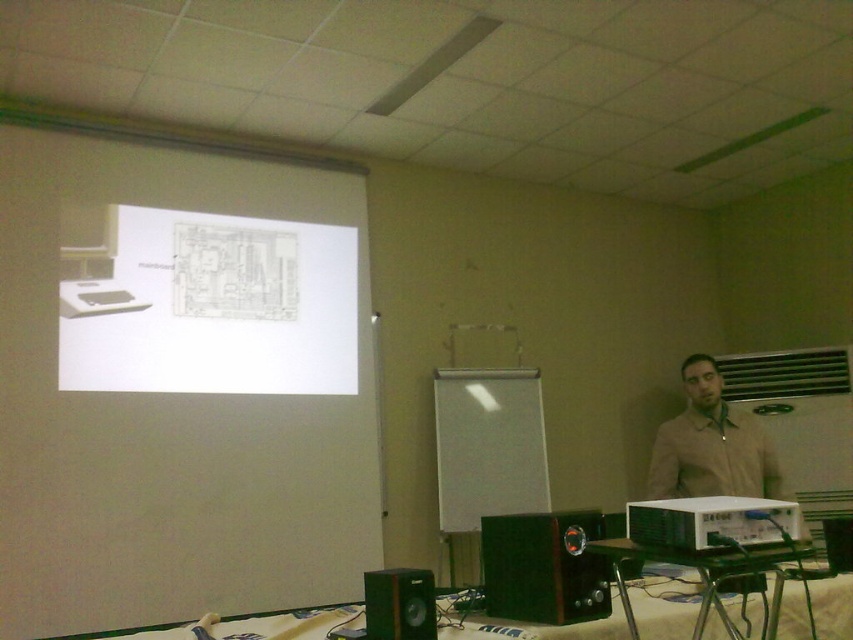
Does black plastic speaker at lower center appear on the left side of beige fabric shirt at right?

Correct, you'll find black plastic speaker at lower center to the left of beige fabric shirt at right.

Describe the element at coordinates (544, 566) in the screenshot. Image resolution: width=853 pixels, height=640 pixels. I see `black plastic speaker at lower center` at that location.

Is point (492, 516) positioned after point (711, 484)?

That is True.

The image size is (853, 640). Identify the location of black plastic speaker at lower center. (544, 566).

Which is more to the left, white paper at upper left or metallic green table at lower center?

white paper at upper left is more to the left.

Is the position of white paper at upper left less distant than that of metallic green table at lower center?

No, white paper at upper left is behind metallic green table at lower center.

The width and height of the screenshot is (853, 640). What are the coordinates of `white paper at upper left` in the screenshot? It's located at (212, 307).

At what (x,y) coordinates should I click in order to perform the action: click on white paper at upper left. Please return your answer as a coordinate pair (x, y). Looking at the image, I should click on (212, 307).

Can you confirm if white matte projection screen at center is positioned to the right of green matte speaker at lower center?

Indeed, white matte projection screen at center is positioned on the right side of green matte speaker at lower center.

The width and height of the screenshot is (853, 640). Find the location of `white matte projection screen at center`. white matte projection screen at center is located at coordinates (488, 445).